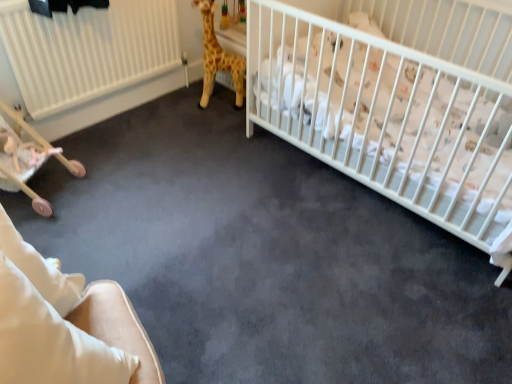
Question: Can you confirm if pink plush toy at lower left is positioned to the right of yellow plush giraffe at upper center?

Choices:
 (A) yes
 (B) no

Answer: (B)

Question: Is pink plush toy at lower left facing towards yellow plush giraffe at upper center?

Choices:
 (A) yes
 (B) no

Answer: (B)

Question: Is yellow plush giraffe at upper center at the back of pink plush toy at lower left?

Choices:
 (A) no
 (B) yes

Answer: (A)

Question: From the image's perspective, is pink plush toy at lower left below yellow plush giraffe at upper center?

Choices:
 (A) yes
 (B) no

Answer: (A)

Question: Is pink plush toy at lower left bigger than yellow plush giraffe at upper center?

Choices:
 (A) no
 (B) yes

Answer: (A)

Question: From a real-world perspective, is pink plush toy at lower left positioned over yellow plush giraffe at upper center based on gravity?

Choices:
 (A) yes
 (B) no

Answer: (B)

Question: From the image's perspective, does beige fabric rocking chair at lower left appear higher than wooden baby carriage at lower left?

Choices:
 (A) yes
 (B) no

Answer: (B)

Question: From a real-world perspective, is beige fabric rocking chair at lower left on wooden baby carriage at lower left?

Choices:
 (A) yes
 (B) no

Answer: (A)

Question: Is beige fabric rocking chair at lower left outside of wooden baby carriage at lower left?

Choices:
 (A) yes
 (B) no

Answer: (A)

Question: Considering the relative positions of beige fabric rocking chair at lower left and wooden baby carriage at lower left in the image provided, is beige fabric rocking chair at lower left to the left of wooden baby carriage at lower left from the viewer's perspective?

Choices:
 (A) yes
 (B) no

Answer: (B)

Question: Is beige fabric rocking chair at lower left oriented away from wooden baby carriage at lower left?

Choices:
 (A) no
 (B) yes

Answer: (A)

Question: Is beige fabric rocking chair at lower left further to camera compared to wooden baby carriage at lower left?

Choices:
 (A) no
 (B) yes

Answer: (A)

Question: Is the position of yellow plush giraffe at upper center less distant than that of white matte crib at upper right?

Choices:
 (A) yes
 (B) no

Answer: (B)